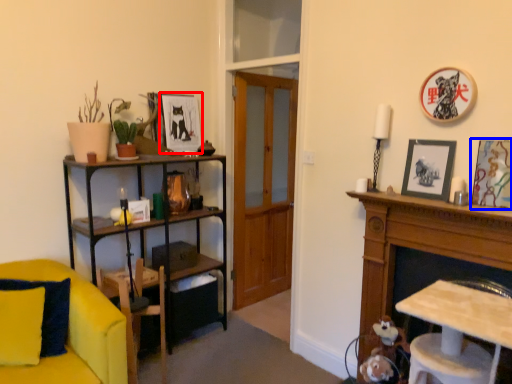
Question: Which object is closer to the camera taking this photo, picture frame (highlighted by a red box) or picture frame (highlighted by a blue box)?

Choices:
 (A) picture frame
 (B) picture frame

Answer: (B)